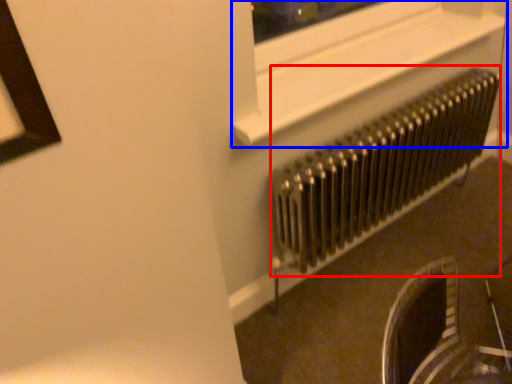
Question: Which of the following is the closest to the observer, radiator (highlighted by a red box) or window frame (highlighted by a blue box)?

Choices:
 (A) radiator
 (B) window frame

Answer: (B)